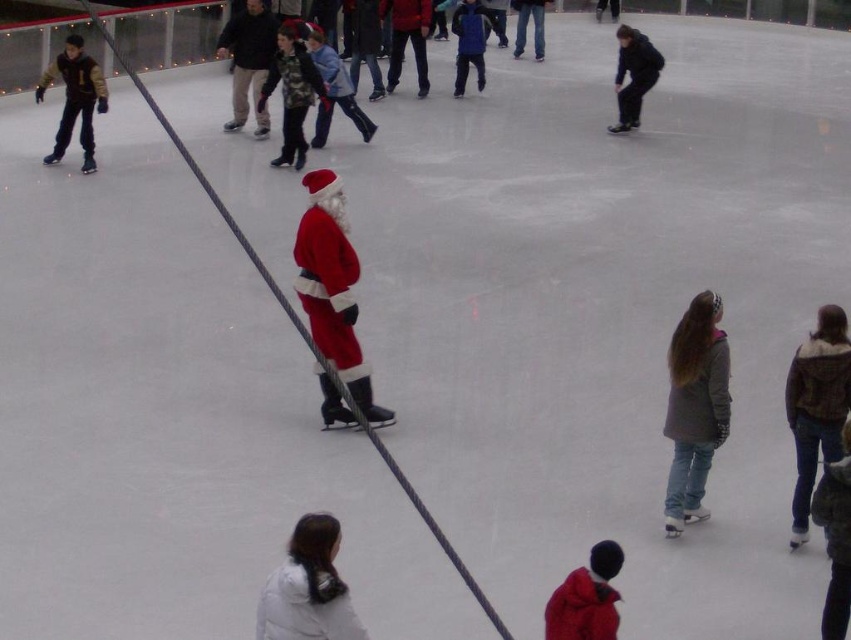
Question: Is white matte jacket at lower center smaller than dark blue jacket at upper right?

Choices:
 (A) no
 (B) yes

Answer: (B)

Question: Does velvet red santa suit at center have a larger size compared to red woolen coat at lower center?

Choices:
 (A) no
 (B) yes

Answer: (B)

Question: Is red woolen coat at lower center smaller than dark blue jacket at upper right?

Choices:
 (A) yes
 (B) no

Answer: (A)

Question: Among these points, which one is farthest from the camera?

Choices:
 (A) (330, 312)
 (B) (700, 406)
 (C) (307, 81)
 (D) (634, 54)

Answer: (D)

Question: Among these points, which one is farthest from the camera?

Choices:
 (A) (84, 60)
 (B) (690, 499)
 (C) (826, 461)

Answer: (A)

Question: Which of the following is the closest to the observer?

Choices:
 (A) (81, 128)
 (B) (574, 588)
 (C) (721, 355)

Answer: (B)